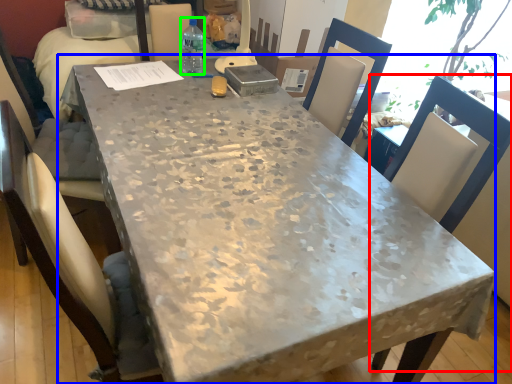
Question: Which object is the closest to the chair (highlighted by a red box)? Choose among these: table (highlighted by a blue box) or bottle (highlighted by a green box).

Choices:
 (A) table
 (B) bottle

Answer: (A)